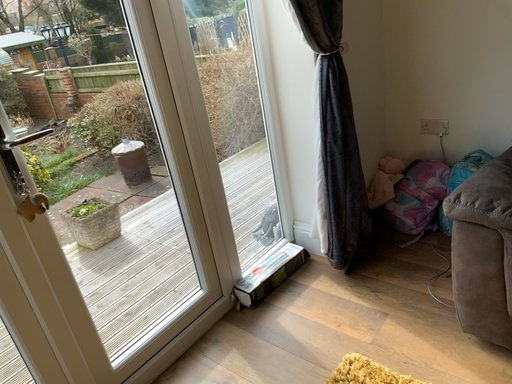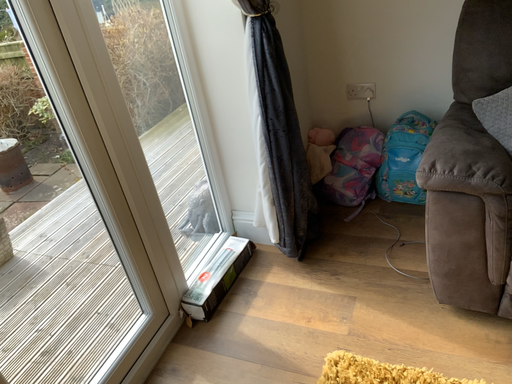
Question: How did the camera likely rotate when shooting the video?

Choices:
 (A) rotated left
 (B) rotated right

Answer: (B)